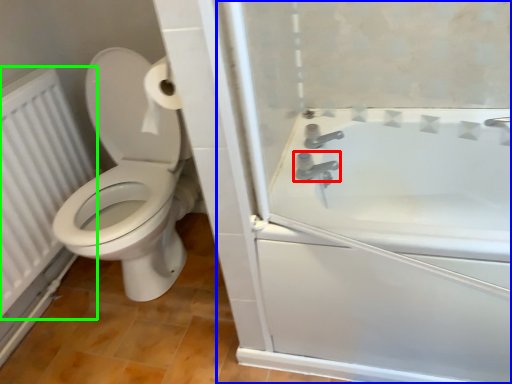
Question: Which is farther away from tap (highlighted by a red box)? screen door (highlighted by a blue box) or radiator (highlighted by a green box)?

Choices:
 (A) screen door
 (B) radiator

Answer: (B)